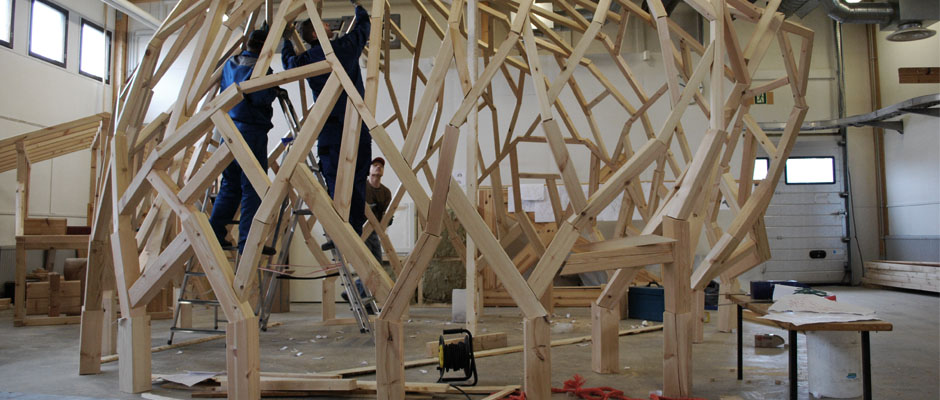
This screenshot has width=940, height=400. In order to click on grey floor in this screenshot , I will do `click(61, 375)`.